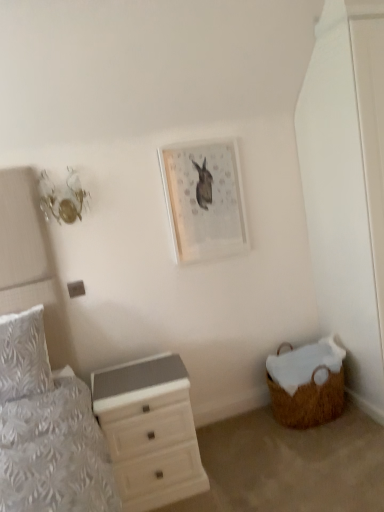
The image size is (384, 512). In order to click on vacant area that lies to the right of white glossy chest of drawers at lower left in this screenshot , I will do `click(232, 466)`.